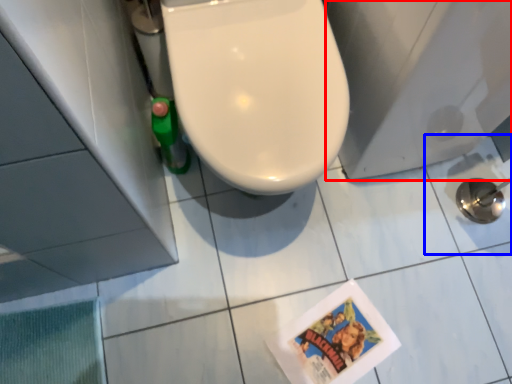
Question: Which object is further to the camera taking this photo, porcelain (highlighted by a red box) or ceramic tile (highlighted by a blue box)?

Choices:
 (A) porcelain
 (B) ceramic tile

Answer: (B)